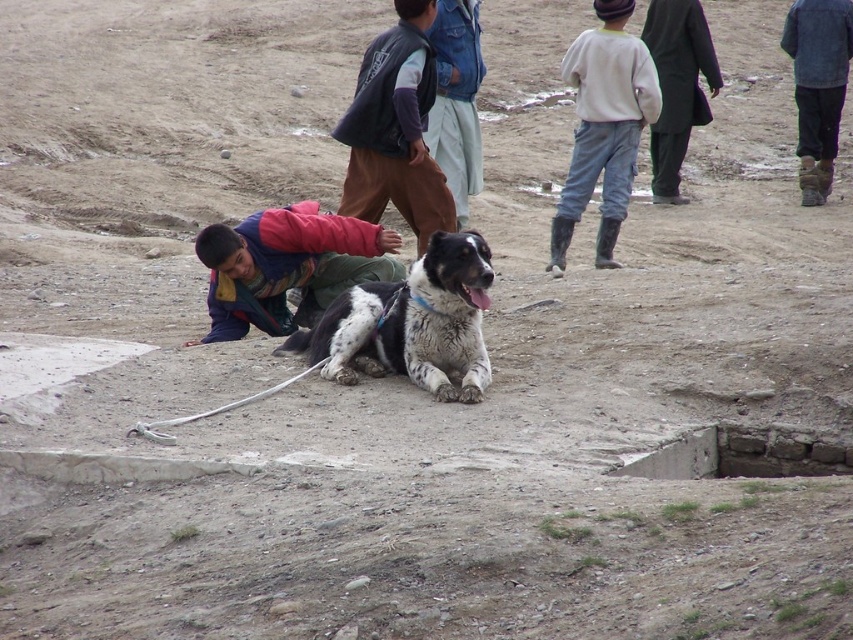
You are a hiker who has just arrived at this sandy area. You see a spotted fur dog at center and a dark brown fabric vest at center. Which object is positioned to the left?

The dark brown fabric vest at center is positioned to the left of the spotted fur dog at center.

You are a photographer setting up a camera on a tripod. You need to position the camera so that both the multicolored fleece jacket at lower left and the dark brown fabric vest at center are in frame. Considering their widths, which object should be placed closer to the camera to ensure both fit within the shot?

The multicolored fleece jacket at lower left is wider than the dark brown fabric vest at center. To ensure both fit in the frame, position the camera so the wider multicolored fleece jacket at lower left is closer to the camera. This way, the size difference can be managed within the shot.

You are standing in the outdoor scene described. You want to locate the spotted fur dog at center. Based on the 2D coordinates provided, where would you look to find it?

The spotted fur dog at center is located at the 2D coordinates point (410,323), which is near the center of the image.